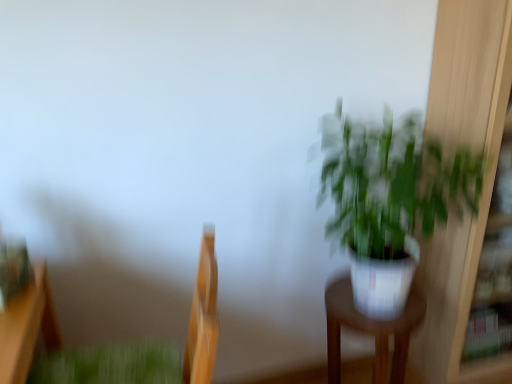
Question: Is white glossy pot at center-right taller than white glossy pot at right?

Choices:
 (A) yes
 (B) no

Answer: (B)

Question: Is the depth of white glossy pot at center-right less than that of white glossy pot at right?

Choices:
 (A) yes
 (B) no

Answer: (B)

Question: Is white glossy pot at center-right further to the viewer compared to white glossy pot at right?

Choices:
 (A) yes
 (B) no

Answer: (A)

Question: Is white glossy pot at center-right oriented away from white glossy pot at right?

Choices:
 (A) yes
 (B) no

Answer: (B)

Question: Is white glossy pot at center-right at the left side of white glossy pot at right?

Choices:
 (A) no
 (B) yes

Answer: (B)

Question: From the image's perspective, is wooden swivel chair at left positioned above or below white glossy pot at center-right?

Choices:
 (A) above
 (B) below

Answer: (A)

Question: Which is correct: wooden swivel chair at left is inside white glossy pot at center-right, or outside of it?

Choices:
 (A) inside
 (B) outside

Answer: (B)

Question: Based on their sizes in the image, would you say wooden swivel chair at left is bigger or smaller than white glossy pot at center-right?

Choices:
 (A) big
 (B) small

Answer: (A)

Question: Considering the positions of wooden swivel chair at left and white glossy pot at center-right in the image, is wooden swivel chair at left wider or thinner than white glossy pot at center-right?

Choices:
 (A) thin
 (B) wide

Answer: (B)

Question: From a real-world perspective, is white glossy pot at right positioned above or below wooden swivel chair at left?

Choices:
 (A) below
 (B) above

Answer: (B)

Question: Considering the positions of white glossy pot at right and wooden swivel chair at left in the image, is white glossy pot at right bigger or smaller than wooden swivel chair at left?

Choices:
 (A) big
 (B) small

Answer: (A)

Question: Considering the positions of point (411, 137) and point (190, 324), is point (411, 137) closer or farther from the camera than point (190, 324)?

Choices:
 (A) closer
 (B) farther

Answer: (B)

Question: Is white glossy pot at right to the left or to the right of wooden swivel chair at left in the image?

Choices:
 (A) right
 (B) left

Answer: (A)

Question: From the image's perspective, is white glossy pot at center-right located above or below white glossy pot at right?

Choices:
 (A) below
 (B) above

Answer: (A)

Question: Would you say white glossy pot at center-right is to the left or to the right of white glossy pot at right in the picture?

Choices:
 (A) left
 (B) right

Answer: (A)